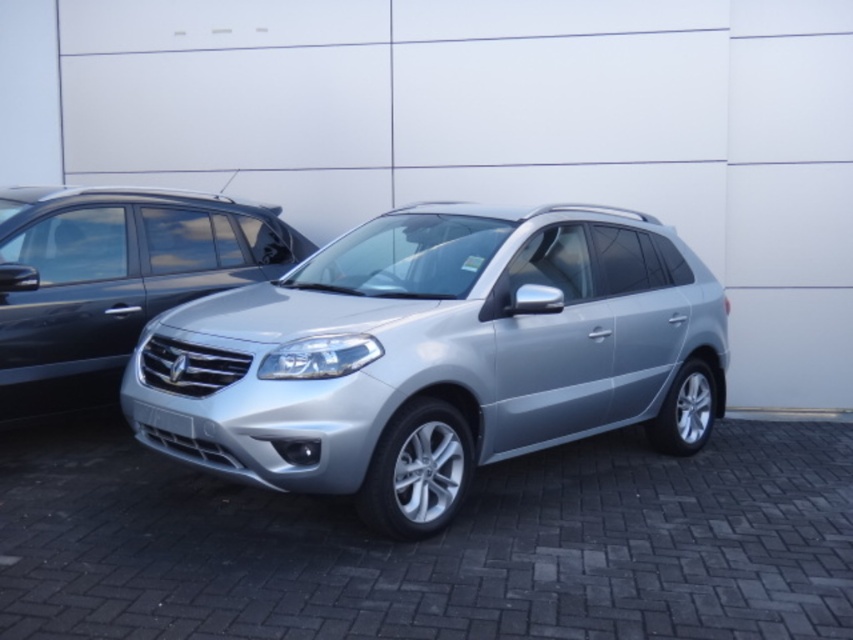
Question: Which object is closer to the camera taking this photo?

Choices:
 (A) satin silver suv at center
 (B) satin silver minivan at left

Answer: (A)

Question: Which point is farther to the camera?

Choices:
 (A) satin silver minivan at left
 (B) satin silver suv at center

Answer: (A)

Question: Can you confirm if satin silver suv at center is bigger than satin silver minivan at left?

Choices:
 (A) no
 (B) yes

Answer: (B)

Question: Is satin silver suv at center to the right of satin silver minivan at left from the viewer's perspective?

Choices:
 (A) yes
 (B) no

Answer: (A)

Question: Is satin silver suv at center above satin silver minivan at left?

Choices:
 (A) yes
 (B) no

Answer: (B)

Question: Which point is farther from the camera taking this photo?

Choices:
 (A) (107, 381)
 (B) (622, 413)

Answer: (A)